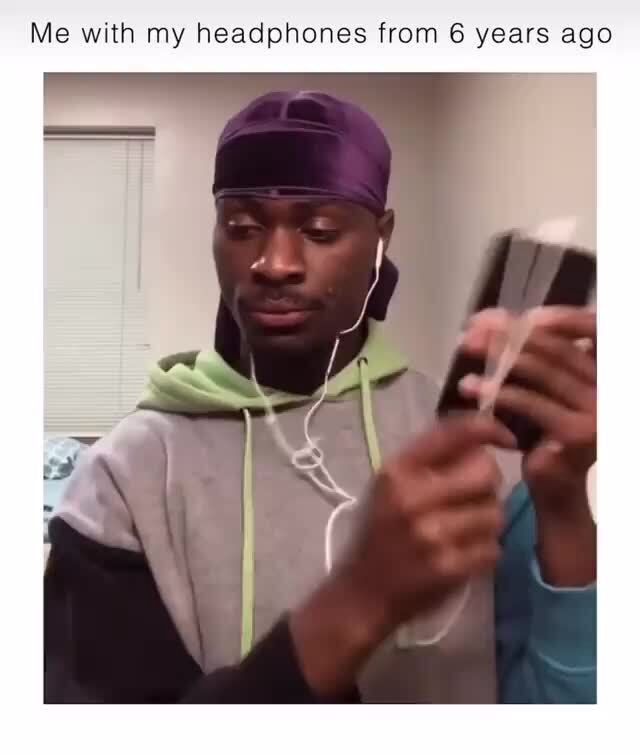
At what (x,y) coordinates should I click in order to perform the action: click on mini blinds. Please return your answer as a coordinate pair (x, y). Looking at the image, I should click on (92, 216).